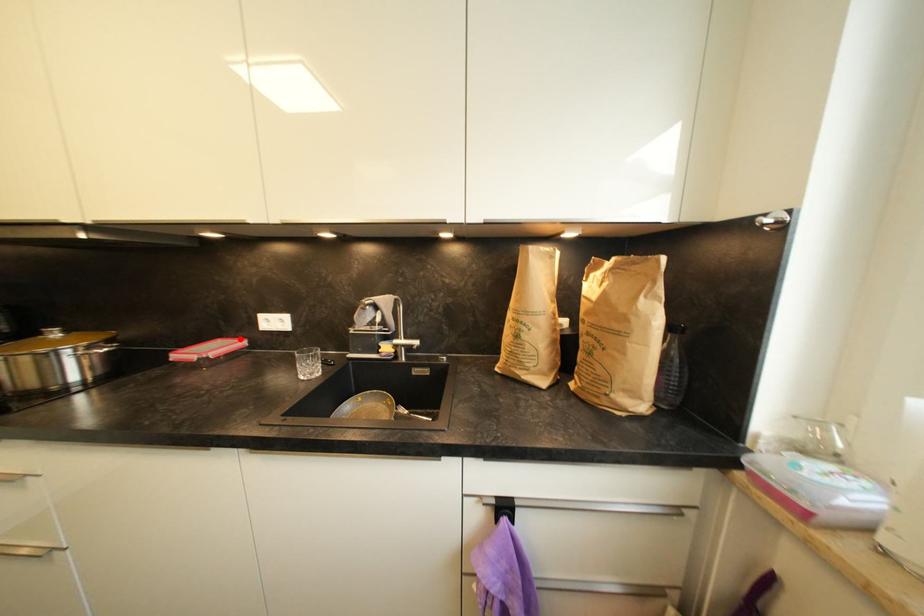
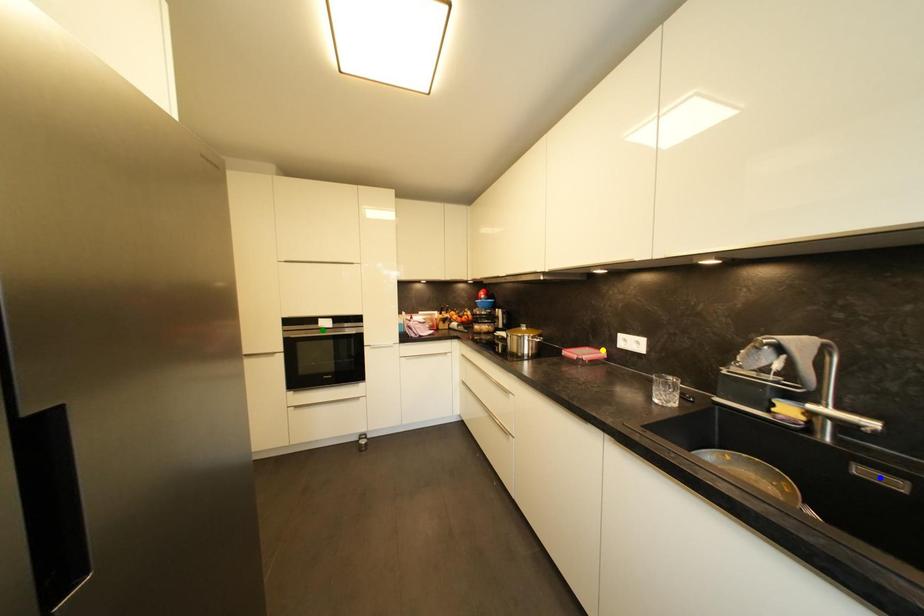
Question: I am providing you with two images of the same scene from different viewpoints. A red point is marked on the first image. You are given multiple points on the second image. Which point in image 2 is actually the same real-world point as the red point in image 1?

Choices:
 (A) yellow point
 (B) blue point
 (C) green point

Answer: (A)